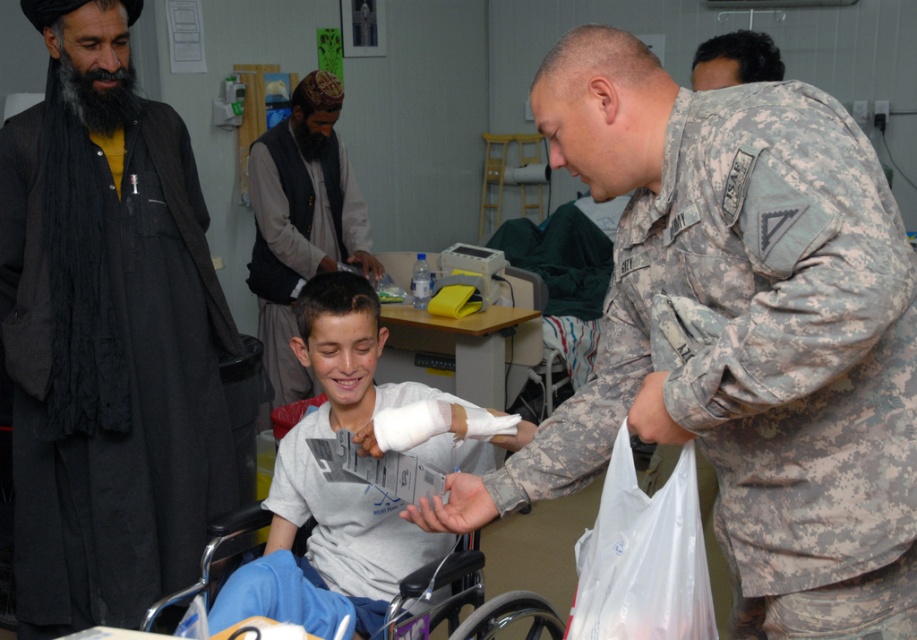
You are a nurse in the medical facility. You need to determine which clothing item is shorter between the camouflage fabric uniform at right and the black matte robe at left. Which one should you choose?

The camouflage fabric uniform at right is not as tall as the black matte robe at left, so the camouflage fabric uniform at right is shorter.

You are a nurse in this medical facility. You need to locate the white matte bandage at center and the gray woolen vest at center. According to the scene, which object is positioned to the right of the other?

The white matte bandage at center is to the right of the gray woolen vest at center.

You are a nurse in the medical facility. You need to place a new bandage that is exactly the same size as the current one on the patient. The current bandage is white matte bandage at center. The medical supply cabinet has a new bandage and a gray woolen vest at center. Which item should you choose?

The white matte bandage at center has a larger width than the gray woolen vest at center. Therefore, you should choose the white matte bandage at center to replace the current one since it matches the required size.